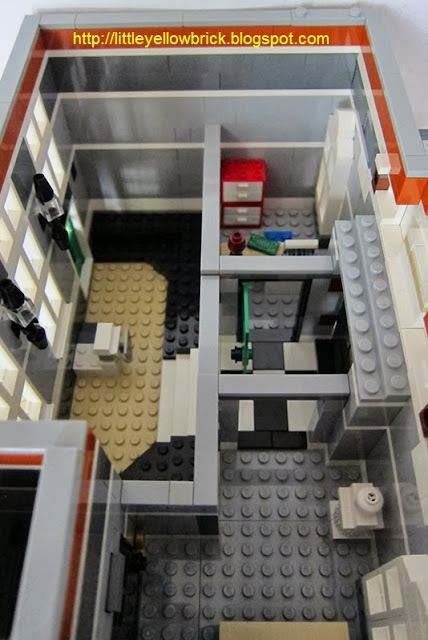
Locate an element on the screen. Image resolution: width=428 pixels, height=640 pixels. furthest rectangular window is located at coordinates (58, 170).